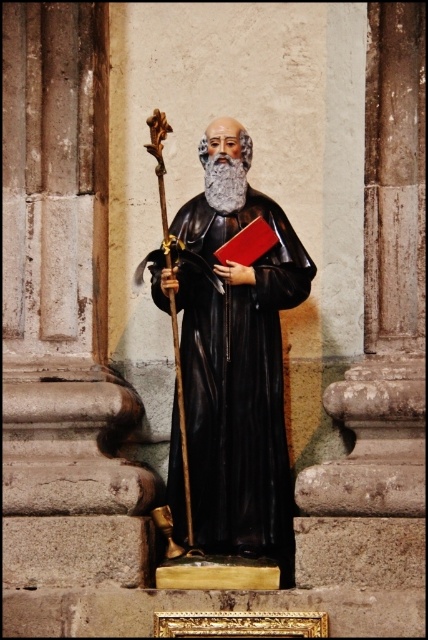
You are an art student analyzing the statue. You notice the black glossy statue at center and the graywoollybeard at center. Which object is positioned lower?

The black glossy statue at center is positioned below the graywoollybeard at center, so the statue is lower.

You are a tourist standing in front of the statue. The statue is located at the point with coordinates (x=229, y=390). Can you tell me what object is at that point?

The point at coordinates (x=229, y=390) indicates the location of the black glossy statue at center.